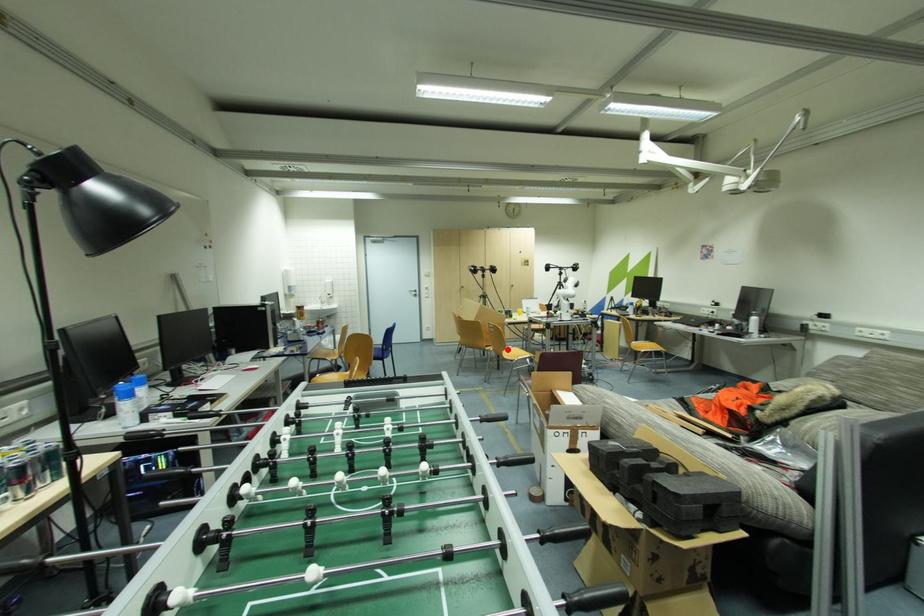
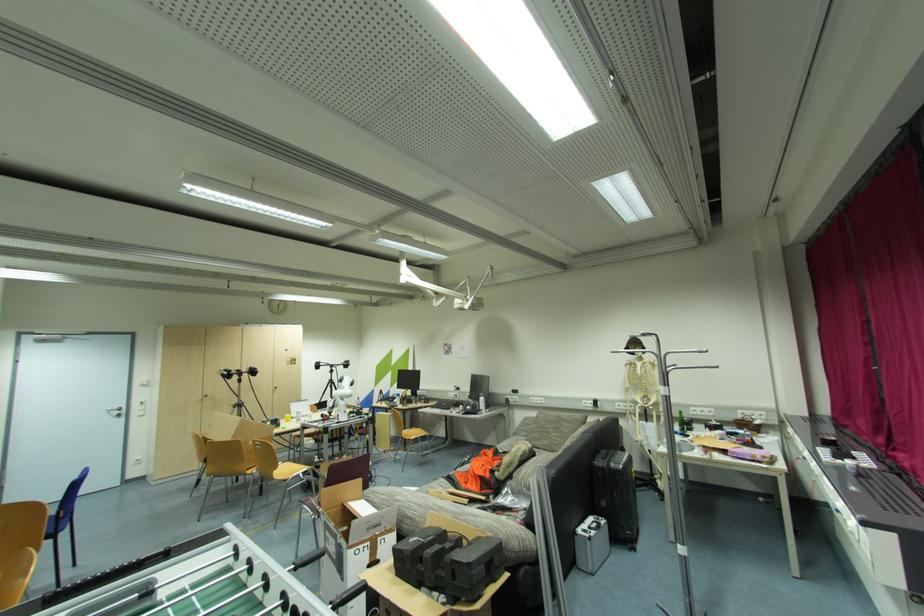
Question: I am providing you with two images of the same scene from different viewpoints. In image1, a red point is highlighted. Considering the same 3D point in image2, which of the following is correct?

Choices:
 (A) It is closer
 (B) It is farther

Answer: (A)